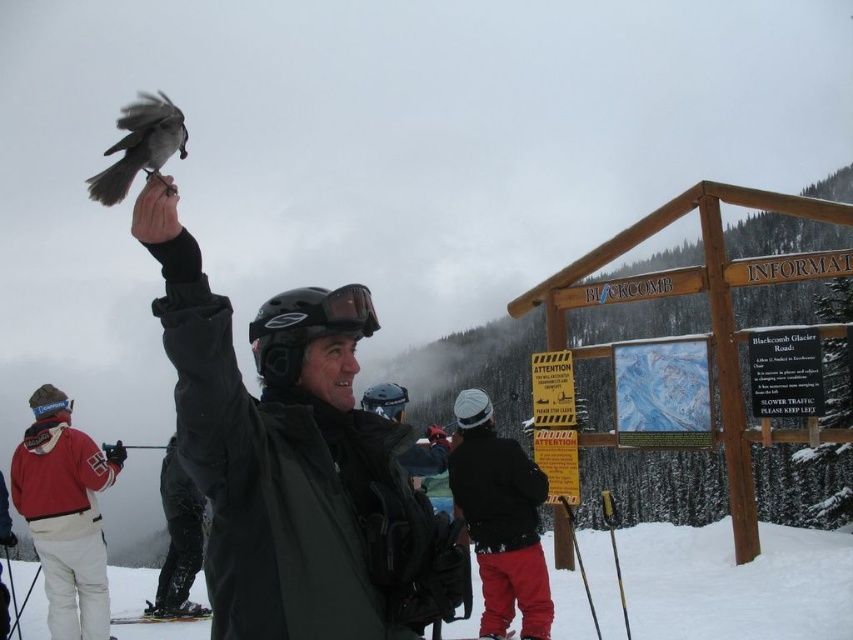
Question: Can you confirm if red fleece jacket at lower left is wider than black matte snow pants at lower left?

Choices:
 (A) yes
 (B) no

Answer: (A)

Question: Is matte black jacket at upper left positioned at the back of black matte snow pants at lower left?

Choices:
 (A) no
 (B) yes

Answer: (A)

Question: Which object is positioned closest to the black matte snow pants at lower left?

Choices:
 (A) matte black jacket at center
 (B) red fleece jacket at lower left
 (C) black matte goggles at upper center
 (D) gray matte bird at upper left

Answer: (B)

Question: Which point is closer to the camera?

Choices:
 (A) (289, 314)
 (B) (647, 580)
 (C) (39, 504)

Answer: (A)

Question: Can you confirm if matte black jacket at center is bigger than black matte snow pants at lower left?

Choices:
 (A) yes
 (B) no

Answer: (A)

Question: Which object is closer to the camera taking this photo?

Choices:
 (A) red fleece jacket at lower left
 (B) matte black jacket at center

Answer: (B)